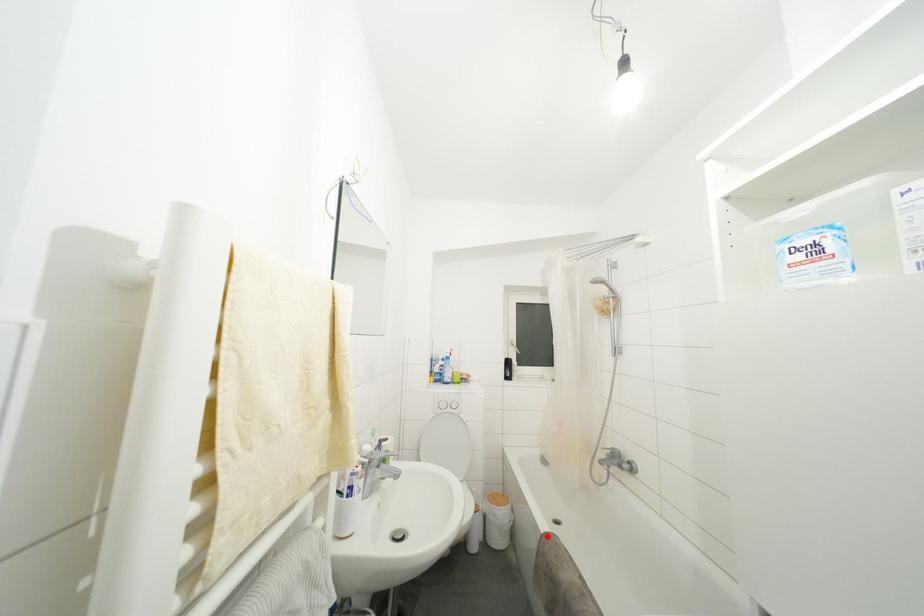
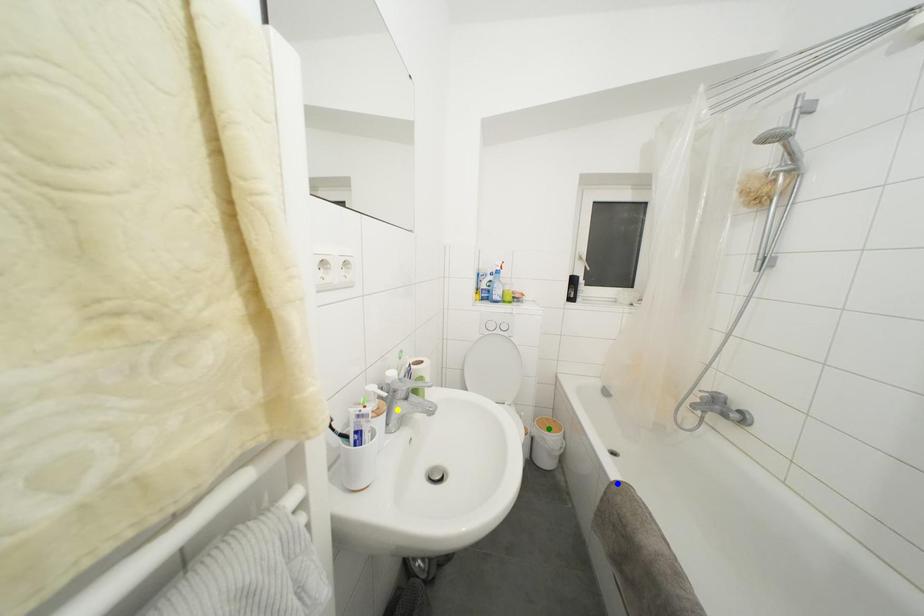
Question: I am providing you with two images of the same scene from different viewpoints. A red point is marked on the first image. You are given multiple points on the second image. In image 2, which mark is for the same physical point as the one in image 1?

Choices:
 (A) blue point
 (B) green point
 (C) yellow point

Answer: (A)